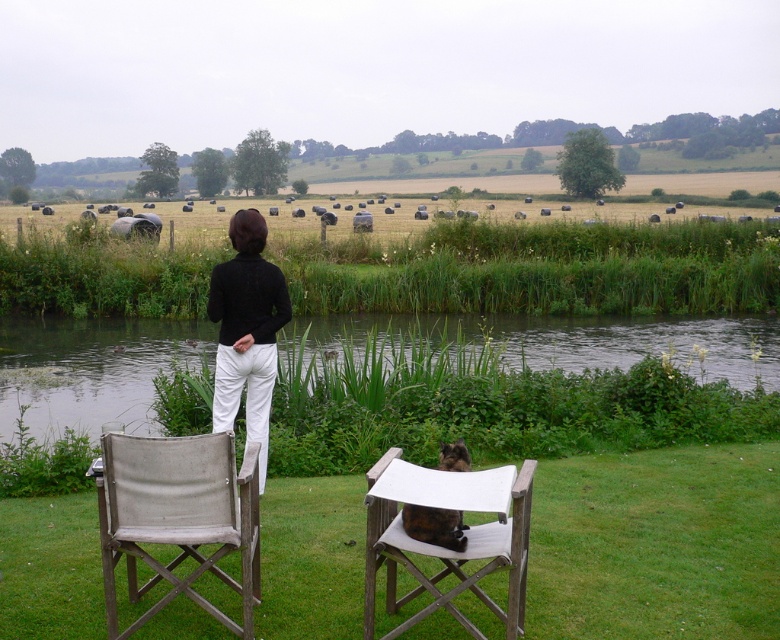
Question: Does gray fabric chair at lower left have a larger size compared to wooden director's chair at lower center?

Choices:
 (A) no
 (B) yes

Answer: (A)

Question: Which object is closer to the camera taking this photo?

Choices:
 (A) black matte pants at center
 (B) clear water at center
 (C) gray fabric chair at lower left

Answer: (C)

Question: Observing the image, what is the correct spatial positioning of wooden director's chair at lower center in reference to black matte pants at center?

Choices:
 (A) above
 (B) below

Answer: (B)

Question: Among these objects, which one is farthest from the camera?

Choices:
 (A) brown furry cat at center
 (B) wooden director's chair at lower center
 (C) black matte pants at center
 (D) gray fabric chair at lower left

Answer: (C)

Question: Does black matte pants at center have a greater width compared to brown furry cat at center?

Choices:
 (A) yes
 (B) no

Answer: (A)

Question: Which point is farther from the camera taking this photo?

Choices:
 (A) (45, 326)
 (B) (461, 516)

Answer: (A)